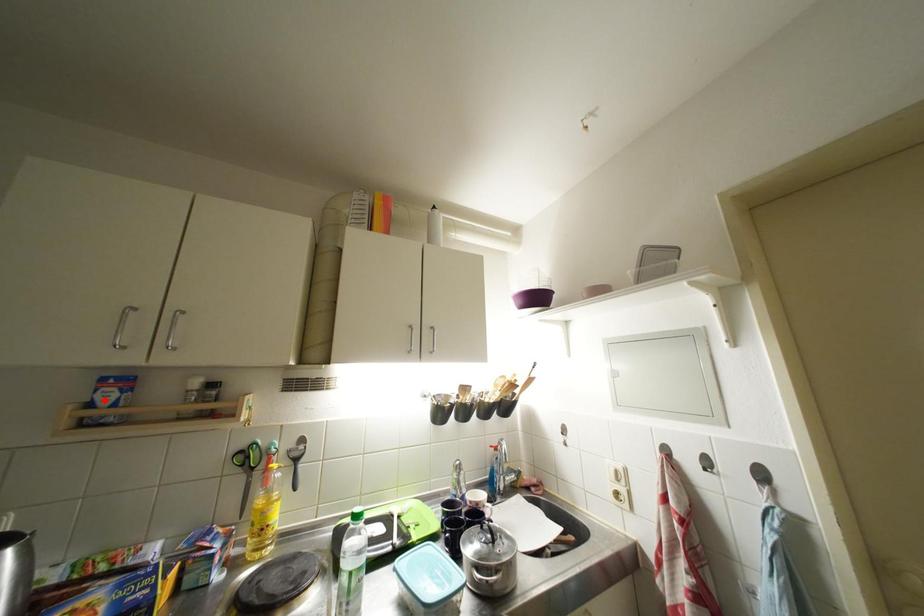
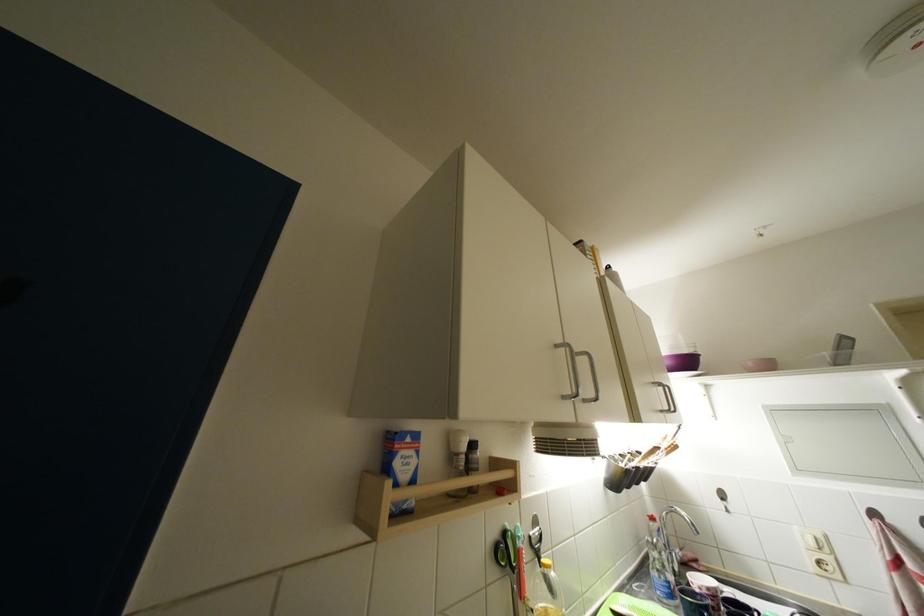
Question: I am providing you with two images of the same scene from different viewpoints. A red point is marked on the first image. At the location where the point appears in image 1, is it still visible in image 2?

Choices:
 (A) Yes
 (B) No

Answer: (A)